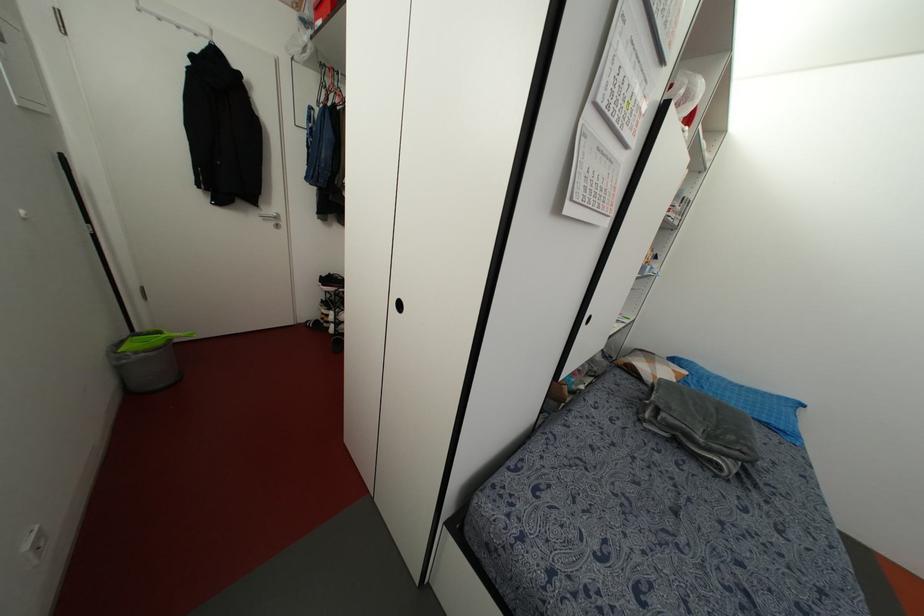
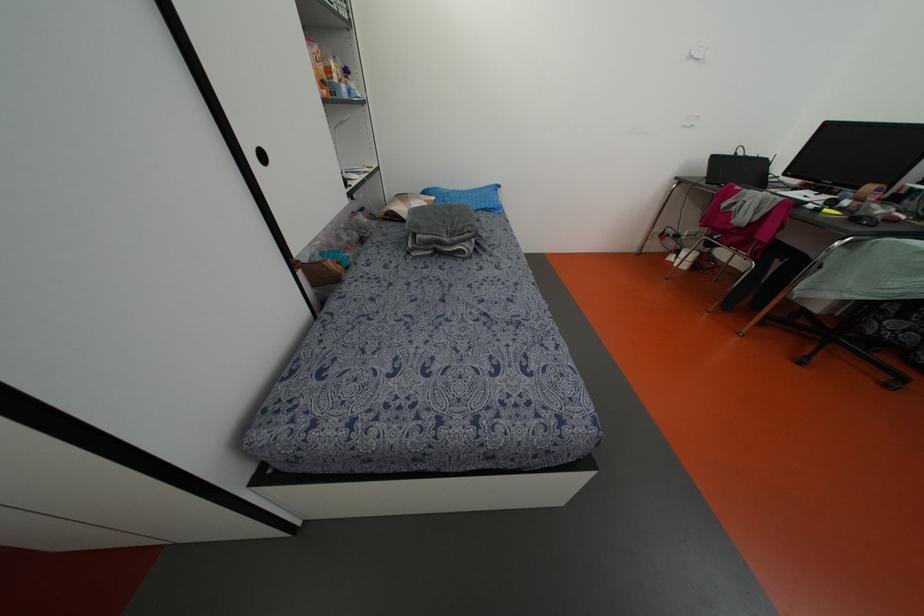
Locate, in the second image, the point that corresponds to (782,427) in the first image.

(492, 206)